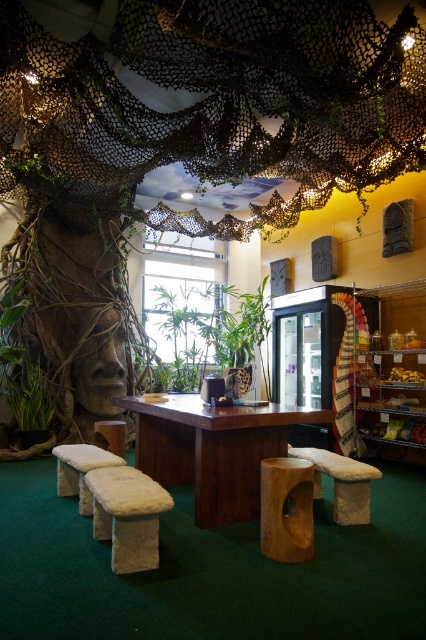
Describe the element at coordinates (342, 483) in the screenshot. I see `beige fabric stool at lower right` at that location.

Who is more distant from viewer, (x=345, y=509) or (x=112, y=444)?

The point (x=112, y=444) is behind.

Who is more forward, (357, 522) or (100, 422)?

Positioned in front is point (357, 522).

You are a GUI agent. You are given a task and a screenshot of the screen. Output one action in this format:
    pyautogui.click(x=<x>, y=<y>)
    Task: Click on the beige fabric stool at lower right
    Image resolution: width=426 pixels, height=640 pixels.
    Given the screenshot: What is the action you would take?
    pyautogui.click(x=342, y=483)

Which is more to the right, white fur stool at center or beige felt stool at lower left?

white fur stool at center

Between point (143, 480) and point (88, 470), which one is positioned in front?

Positioned in front is point (143, 480).

This screenshot has height=640, width=426. I want to click on white fur stool at center, so click(x=127, y=515).

Does brown textured tree trunk at center lie behind beige fabric stool at center?

No.

This screenshot has width=426, height=640. What do you see at coordinates (209, 108) in the screenshot?
I see `brown textured tree trunk at center` at bounding box center [209, 108].

Find the location of a particular element. brown textured tree trunk at center is located at coordinates (209, 108).